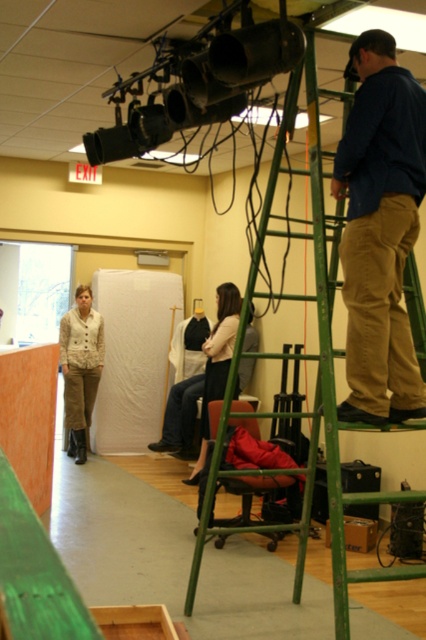
Is matte black video camera at upper center wider than white fabric at center?

Correct, the width of matte black video camera at upper center exceeds that of white fabric at center.

Can you confirm if matte black video camera at upper center is positioned above white fabric at center?

Yes.

Find the location of a particular element. This screenshot has width=426, height=640. matte black video camera at upper center is located at coordinates (x=198, y=81).

Image resolution: width=426 pixels, height=640 pixels. What do you see at coordinates (379, 230) in the screenshot?
I see `dark blue cotton shirt at upper right` at bounding box center [379, 230].

Which is behind, point (385, 74) or point (230, 296)?

The point (230, 296) is behind.

This screenshot has width=426, height=640. In order to click on dark blue cotton shirt at upper right in this screenshot , I will do `click(379, 230)`.

Is green metal ladder at upper right thinner than white fabric at center?

No.

Locate an element on the screen. The image size is (426, 640). green metal ladder at upper right is located at coordinates (328, 365).